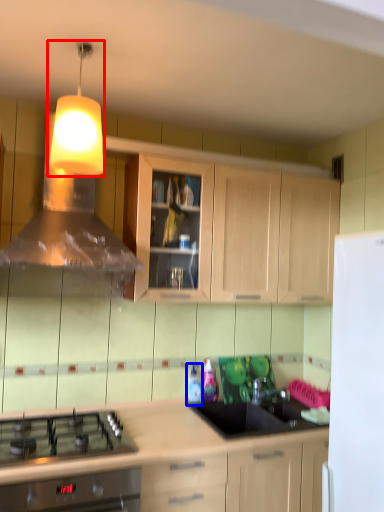
Question: Which point is closer to the camera, light fixture (highlighted by a red box) or bottle (highlighted by a blue box)?

Choices:
 (A) light fixture
 (B) bottle

Answer: (A)